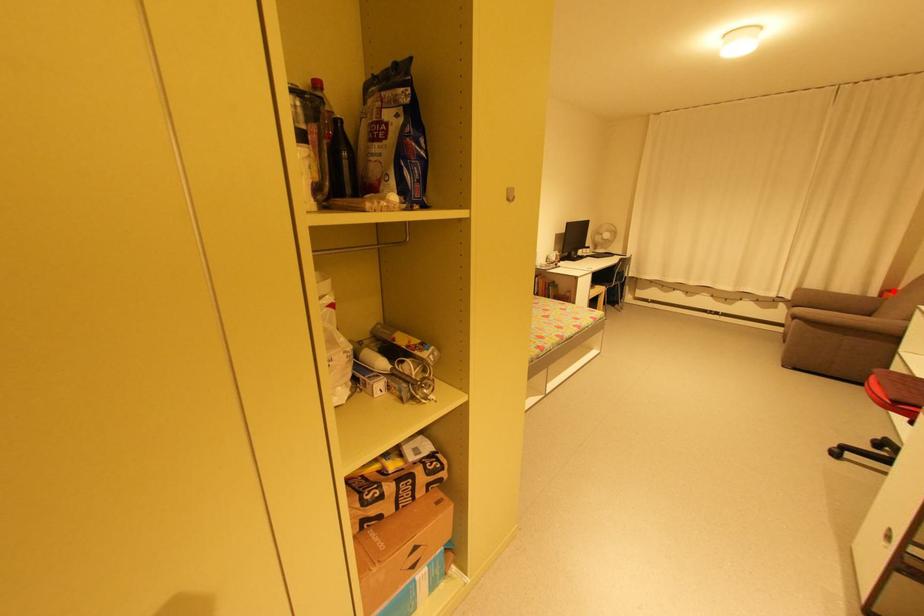
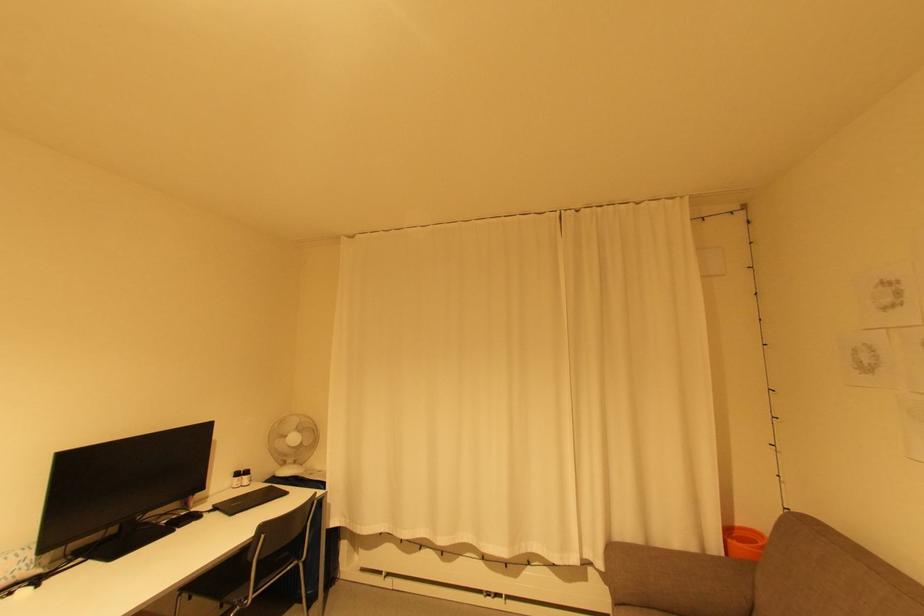
Question: I am providing you with two images of the same scene from different viewpoints. In image1, a red point is highlighted. Considering the same 3D point in image2, which of the following is correct?

Choices:
 (A) It is closer
 (B) It is farther

Answer: (A)